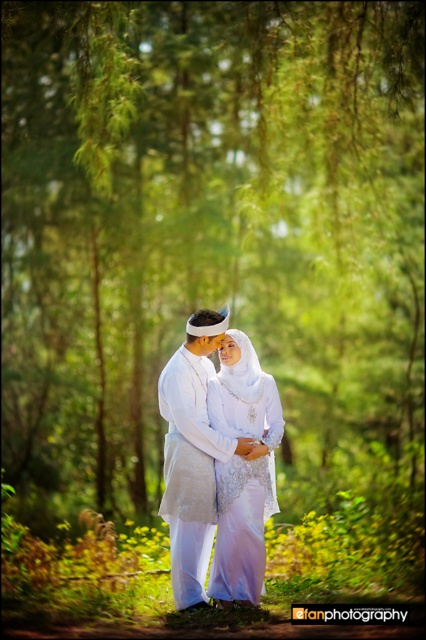
You are a photographer trying to capture the couple in the forest. You notice two points marked in the scene. The first point is at coordinate point (273,388) and the second is at point (164,476). If you want to focus on the point that is closer to the camera, which coordinate should you choose?

Point (164,476) is closer to the camera than point (273,388), so you should focus on point (164,476).

You are a photographer setting up a camera to capture the couple in the forest. The white satin dress at center and the white satin robe at center are both in the frame. Which of the two clothing items appears narrower in the photo?

The white satin dress at center appears narrower in the photo because it is thinner than the white satin robe at center.

You are a photographer adjusting your camera to focus on the couple in the forest. You notice the white satin dress at center and the white satin robe at center. Which one should you focus on first if you want to capture the closest item to the camera?

The white satin dress at center is closer to the camera, so you should focus on the white satin dress at center first.